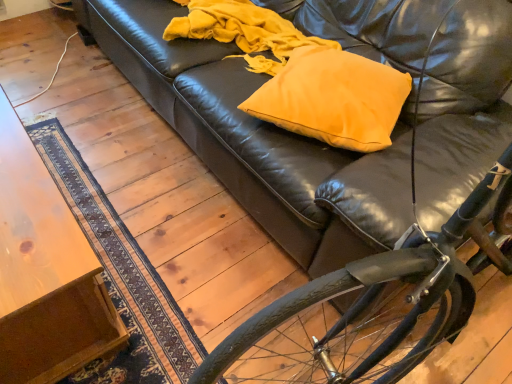
Locate an element on the screen. Image resolution: width=512 pixels, height=384 pixels. free space to the back side of wooden table at lower left is located at coordinates (112, 138).